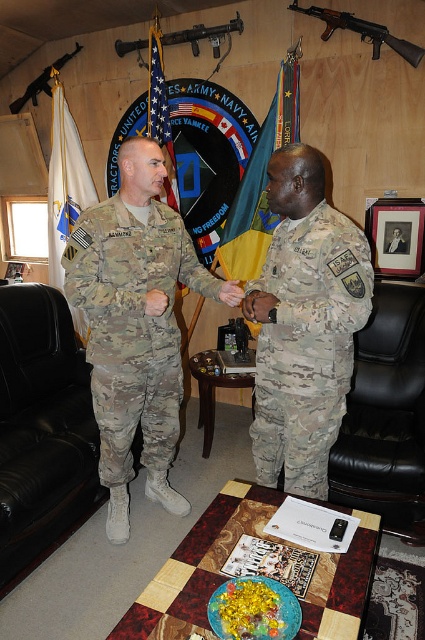
Question: Which point is closer to the camera?

Choices:
 (A) matte black rifle at upper center
 (B) camouflage fabric uniform at center
 (C) blue fabric flag at center

Answer: (B)

Question: Among these objects, which one is nearest to the camera?

Choices:
 (A) white fabric flag at left
 (B) camouflage fabric uniform at left
 (C) camouflage fabric uniform at center
 (D) green fabric flag at center

Answer: (C)

Question: Can you confirm if camouflage fabric uniform at left is thinner than matte black rifle at upper center?

Choices:
 (A) yes
 (B) no

Answer: (A)

Question: Is matte black rifle at upper right further to camera compared to matte black rifle at upper center?

Choices:
 (A) no
 (B) yes

Answer: (A)

Question: Among these objects, which one is farthest from the camera?

Choices:
 (A) matte black rifle at upper right
 (B) camouflage fabric uniform at left
 (C) matte black rifle at upper center

Answer: (C)

Question: Is camouflage fabric uniform at center wider than blue fabric flag at center?

Choices:
 (A) yes
 (B) no

Answer: (A)